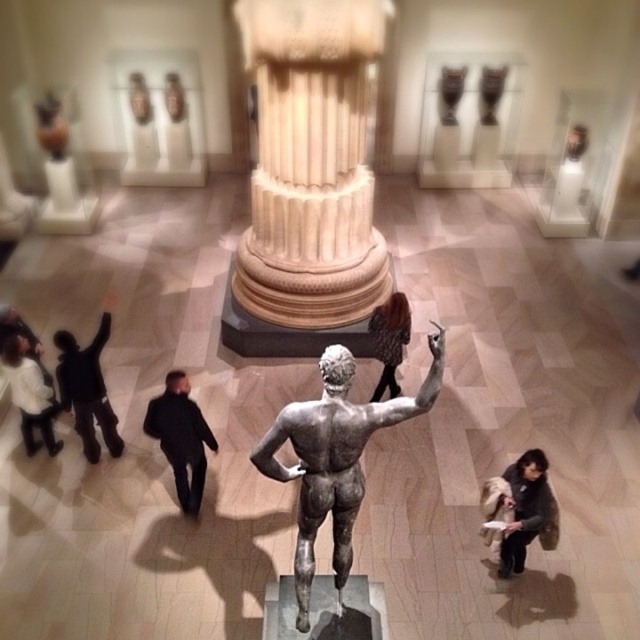
You are a tour guide leading visitors through the museum. You want to direct them to the bronze statue at center. Based on the scene description, where should they look in relation to the central marble column?

The bronze statue at center is located at point coordinates relative to the central marble column, but since the exact spatial relationship isn

You are a visitor standing in the museum and want to take a photo of both the white marble column at center and the bronze statue at center. Since you can only focus on one object at a time, which one should you position closer to the camera to ensure it is in focus while the other remains slightly blurred?

You should position the bronze statue at center closer to the camera because the white marble column at center is to the left of it, so adjusting the focus on the bronze statue at center will keep it sharp while the column may blur slightly depending on the depth of field.

You are a security guard in the museum and need to check if the bronze statue at center can be safely moved closer to the black matte jacket at left without violating the 10 feet safety distance rule. Can you move it?

The bronze statue at center is currently 9.21 feet away from the black matte jacket at left. Since the required safety distance is 10 feet, moving the statue closer would reduce the distance below the required 10 feet. Therefore, you cannot move the bronze statue at center closer to the black matte jacket at left without violating the safety rule.